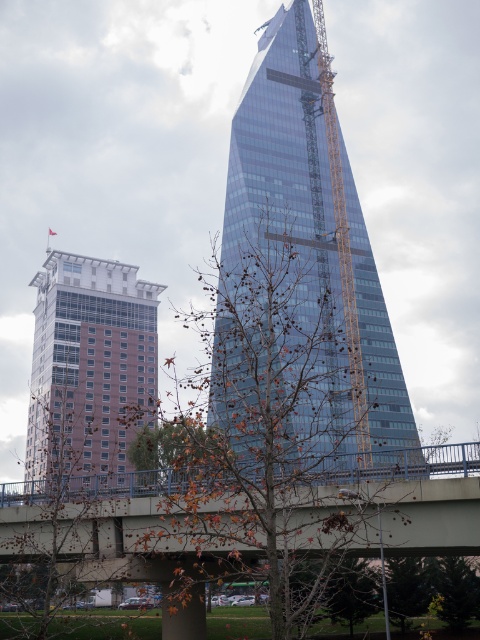
Is point (46, 308) more distant than point (349, 339)?

That is True.

Is brown brick building at left taller than yellow metallic crane at center?

Incorrect, brown brick building at left's height is not larger of yellow metallic crane at center's.

Measure the distance between point (146, 339) and camera.

Point (146, 339) is 512.17 feet away from camera.

Image resolution: width=480 pixels, height=640 pixels. What are the coordinates of `brown brick building at left` in the screenshot? It's located at (90, 365).

How far apart are brown leafy tree at center and brown brick building at left?

brown leafy tree at center and brown brick building at left are 21.96 meters apart from each other.

Does brown leafy tree at center have a lesser height compared to brown brick building at left?

In fact, brown leafy tree at center may be taller than brown brick building at left.

What do you see at coordinates (290, 360) in the screenshot? The height and width of the screenshot is (640, 480). I see `brown leafy tree at center` at bounding box center [290, 360].

The image size is (480, 640). Find the location of `brown leafy tree at center`. brown leafy tree at center is located at coordinates (290, 360).

Can you confirm if brown leafy tree at center is positioned to the left of yellow metallic crane at center?

Indeed, brown leafy tree at center is positioned on the left side of yellow metallic crane at center.

Is point (327, 253) positioned after point (360, 346)?

Yes, point (327, 253) is behind point (360, 346).

What are the coordinates of `brown leafy tree at center` in the screenshot? It's located at (290, 360).